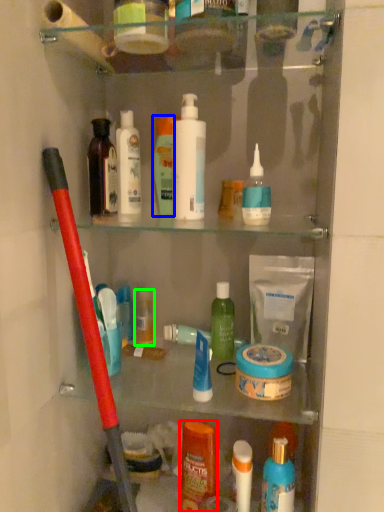
Question: Which is nearer to the toiletry (highlighted by a red box)? toiletry (highlighted by a blue box) or toiletry (highlighted by a green box).

Choices:
 (A) toiletry
 (B) toiletry

Answer: (B)